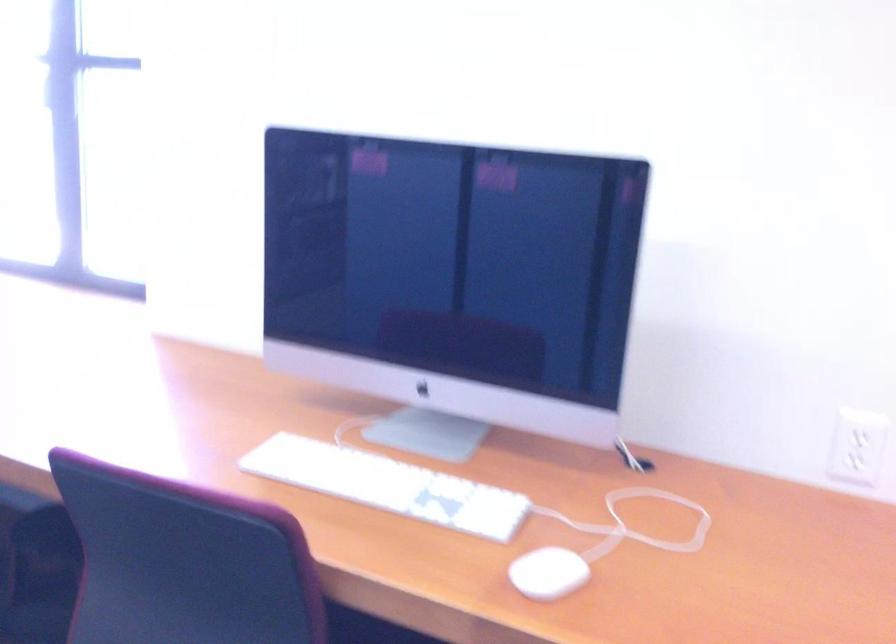
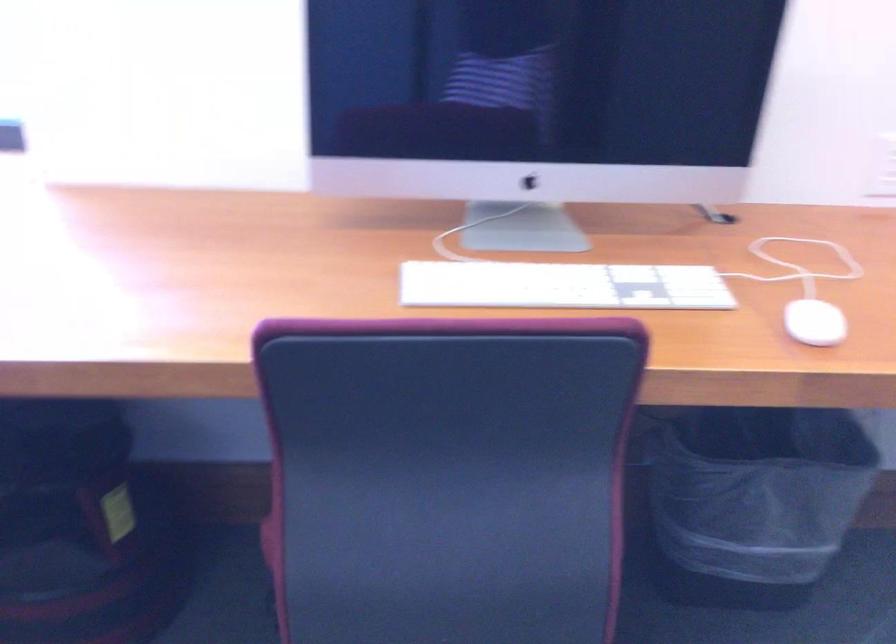
The images are taken continuously from a first-person perspective. In which direction is your viewpoint rotating?

The camera's rotation is toward right-down.